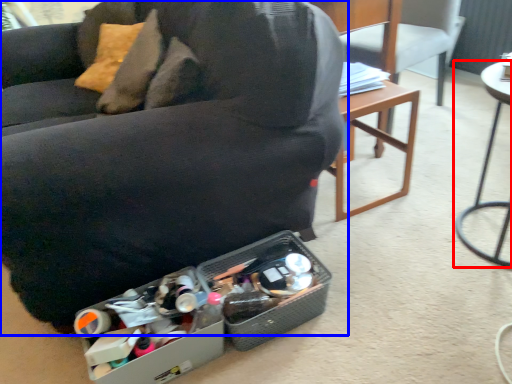
Question: Among these objects, which one is farthest to the camera, table (highlighted by a red box) or chair (highlighted by a blue box)?

Choices:
 (A) table
 (B) chair

Answer: (A)